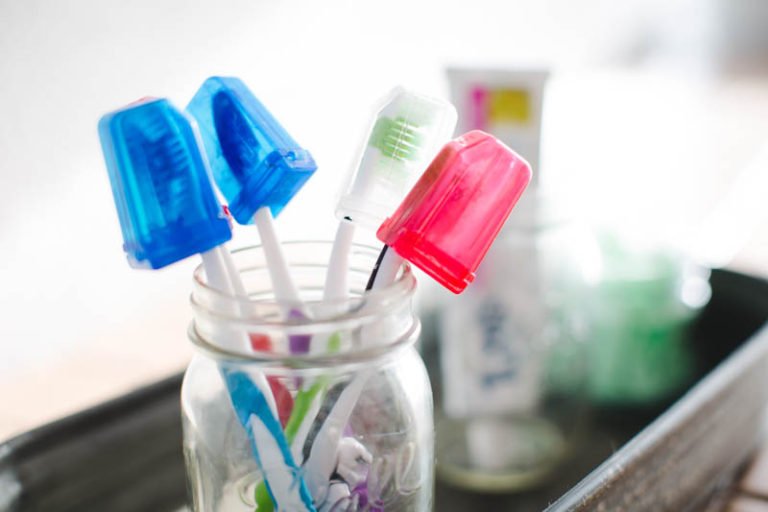
Identify the location of red toothbrush cap. This screenshot has height=512, width=768. (477, 200).